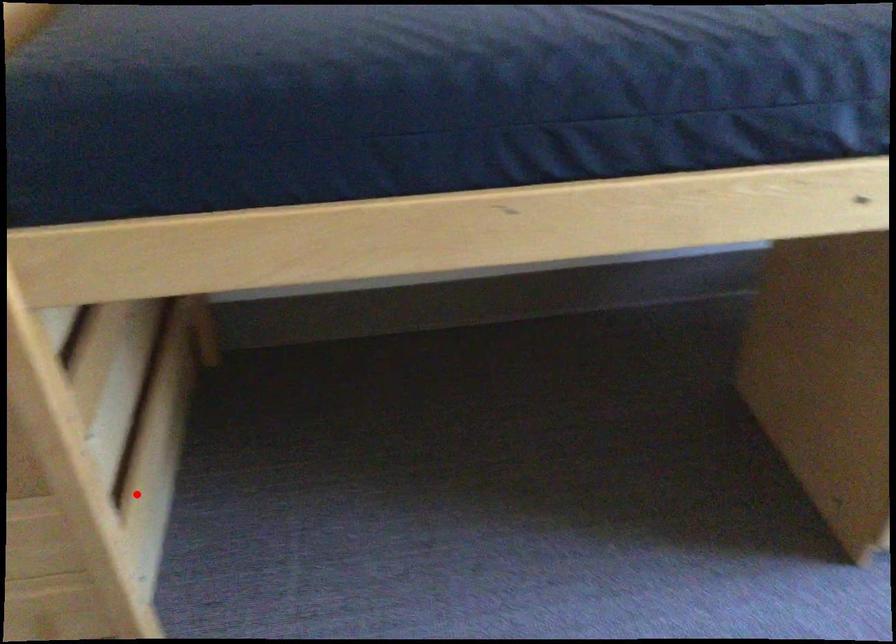
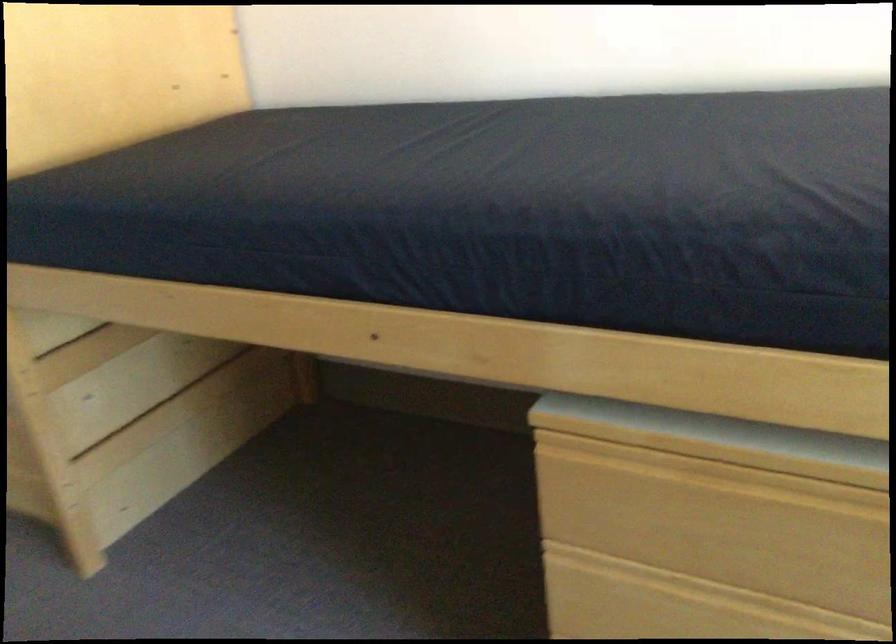
Question: I am providing you with two images of the same scene from different viewpoints. Image1 has a red point marked. In image2, the corresponding 3D location appears at what relative position? Reply with the corresponding letter.

Choices:
 (A) Closer
 (B) Farther

Answer: (B)